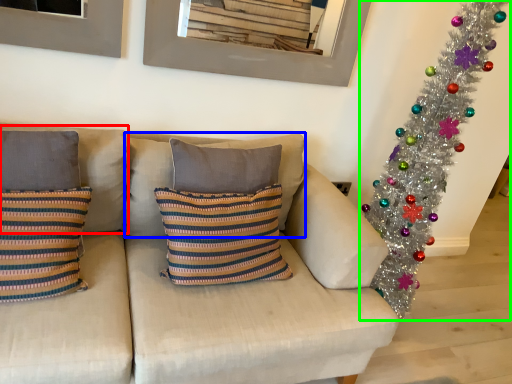
Question: Based on their relative distances, which object is farther from pillow (highlighted by a red box)? Choose from pillow (highlighted by a blue box) and christmas tree (highlighted by a green box).

Choices:
 (A) pillow
 (B) christmas tree

Answer: (B)